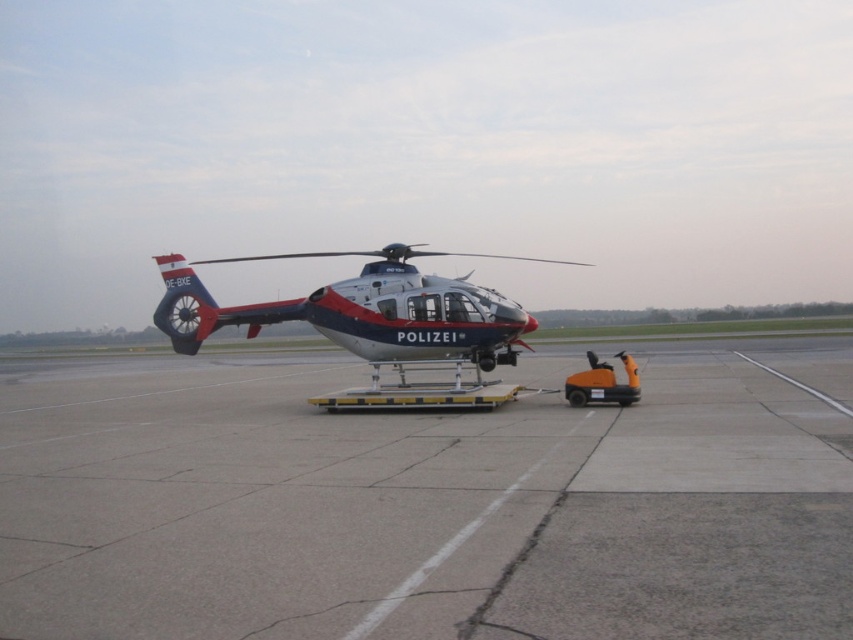
Does point (352, 365) come in front of point (383, 349)?

That is False.

Identify the location of gray concrete tarmac at center. This screenshot has height=640, width=853. (425, 506).